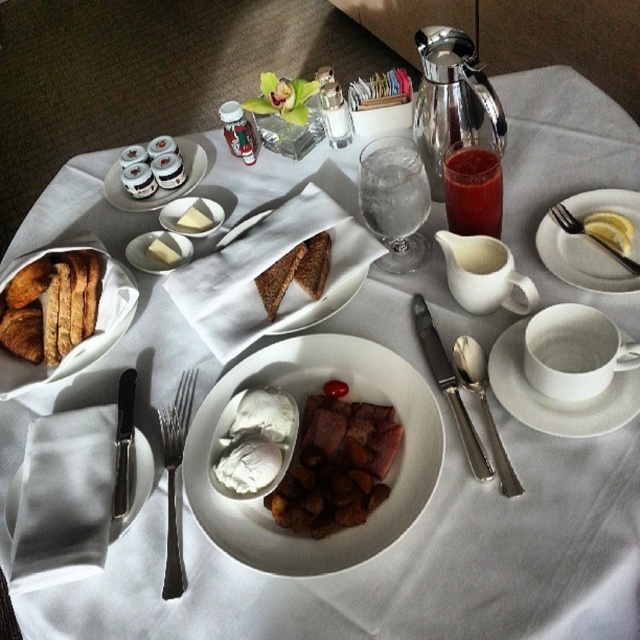
You are a guest at this breakfast table and want to reach for the yellow lemon slice at upper right without moving the white ceramic plate at upper left. Is this possible?

The white ceramic plate at upper left is positioned on the left side of yellow lemon slice at upper right, so there is space between them. Therefore, you can reach for the yellow lemon slice at upper right without moving the white ceramic plate at upper left.

You are sitting at the breakfast table and want to reach for an item located at point (x=621, y=227) and another item at point (x=236, y=228). Which item is closer to you?

The item at point (x=621, y=227) is closer because it is in front of the other point.